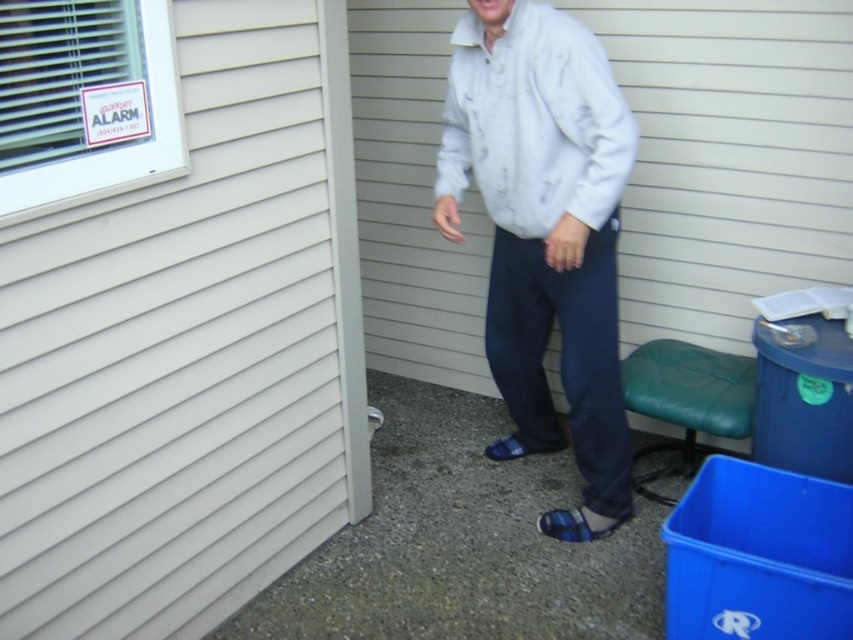
Question: Observing the image, what is the correct spatial positioning of light gray cotton jacket at center in reference to blue plaid sandal at lower center?

Choices:
 (A) left
 (B) right

Answer: (A)

Question: Which object is the farthest from the light gray cotton jacket at center?

Choices:
 (A) white siding at center
 (B) white siding at upper left
 (C) white cotton shirt at center

Answer: (B)

Question: Based on their relative distances, which object is farther from the light gray cotton jacket at center?

Choices:
 (A) white cotton shirt at center
 (B) white siding at center
 (C) blue plaid sandal at lower center

Answer: (C)

Question: Which object is closer to the camera taking this photo?

Choices:
 (A) white cotton shirt at center
 (B) white siding at center

Answer: (A)

Question: Does white siding at center have a larger size compared to white cotton shirt at center?

Choices:
 (A) no
 (B) yes

Answer: (B)

Question: Is light gray cotton jacket at center wider than blue plaid sandal at lower center?

Choices:
 (A) yes
 (B) no

Answer: (A)